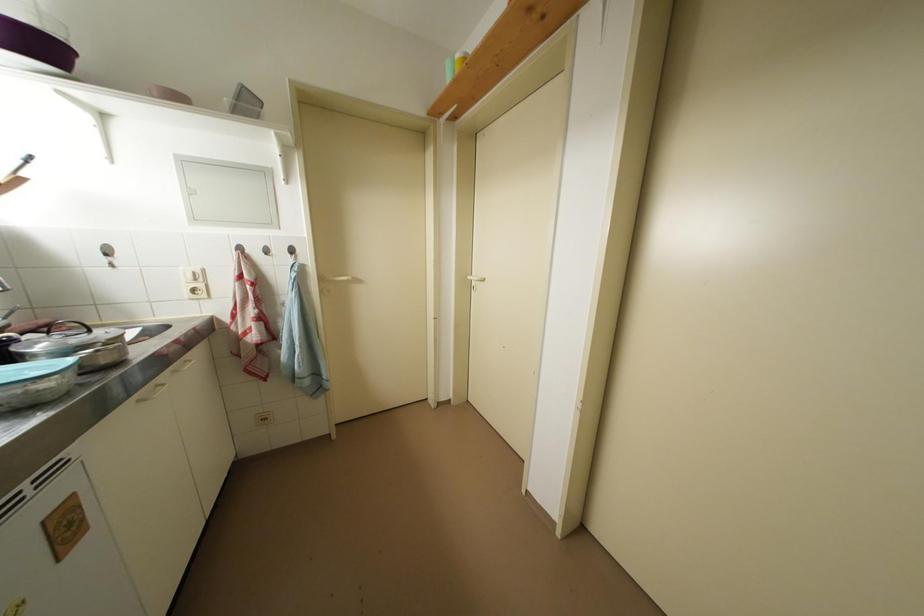
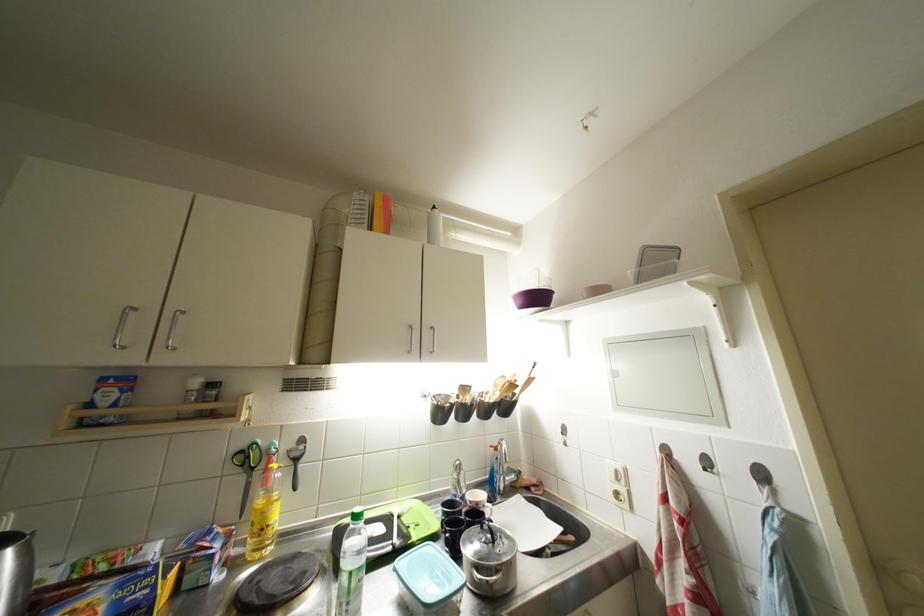
Locate, in the second image, the point that corresponds to [274,254] in the first image.

(714, 467)